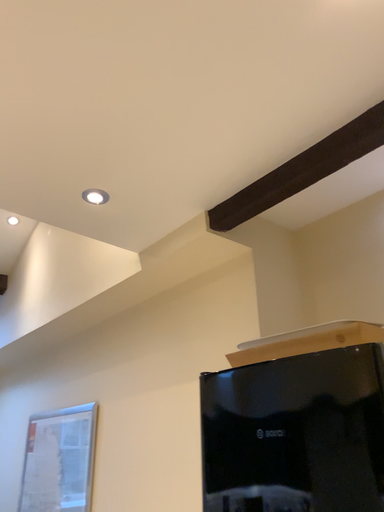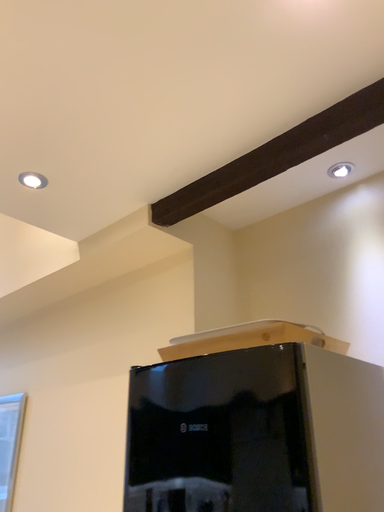
Question: How did the camera likely rotate when shooting the video?

Choices:
 (A) rotated left
 (B) rotated right

Answer: (B)